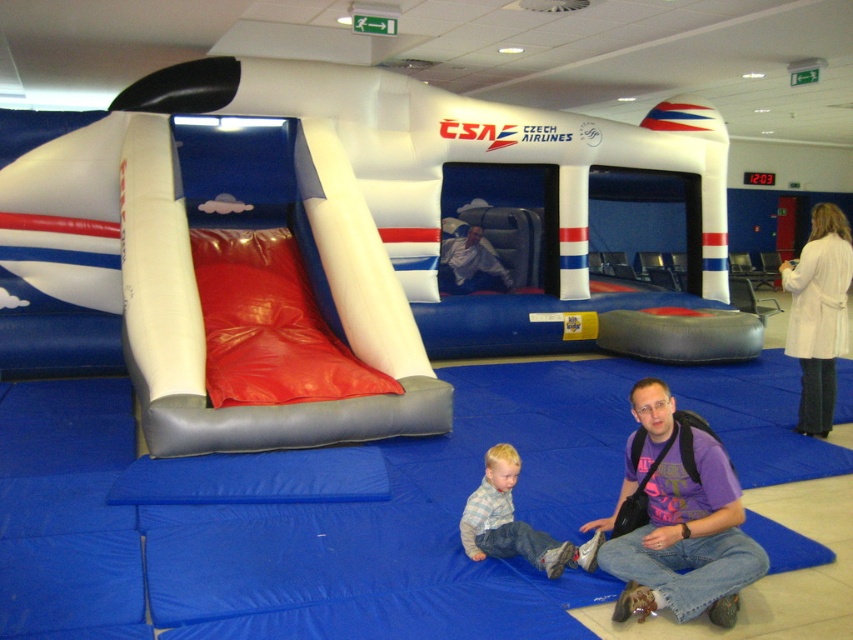
Is purple cotton t-shirt at lower center below white wool coat at upper right?

Yes.

Who is positioned more to the right, purple cotton t-shirt at lower center or white wool coat at upper right?

Positioned to the right is white wool coat at upper right.

Is point (677, 522) farther from camera compared to point (793, 305)?

No, it is in front of (793, 305).

Identify the location of purple cotton t-shirt at lower center. The image size is (853, 640). (677, 518).

Which is behind, point (354, 166) or point (828, 378)?

Positioned behind is point (354, 166).

Who is lower down, white inflatable slide at center or white wool coat at upper right?

white inflatable slide at center

Is point (15, 294) more distant than point (817, 298)?

Yes, point (15, 294) is farther from viewer.

Where is `white inflatable slide at center`? Image resolution: width=853 pixels, height=640 pixels. white inflatable slide at center is located at coordinates (309, 234).

Does purple cotton t-shirt at lower center have a larger size compared to white fabric man at center?

No, purple cotton t-shirt at lower center is not bigger than white fabric man at center.

Is purple cotton t-shirt at lower center shorter than white fabric man at center?

Correct, purple cotton t-shirt at lower center is not as tall as white fabric man at center.

Where is `purple cotton t-shirt at lower center`? The width and height of the screenshot is (853, 640). purple cotton t-shirt at lower center is located at coordinates (677, 518).

Where is `purple cotton t-shirt at lower center`? The width and height of the screenshot is (853, 640). purple cotton t-shirt at lower center is located at coordinates (677, 518).